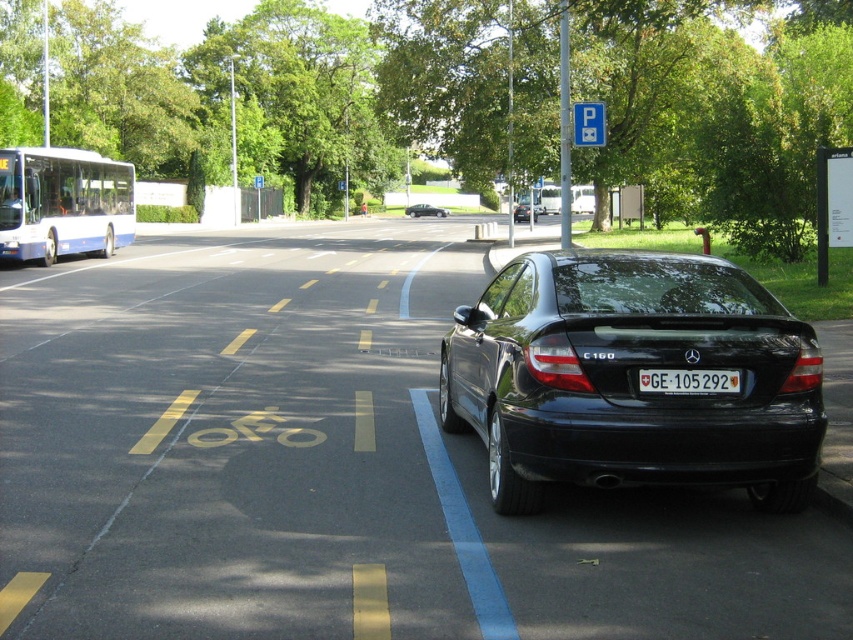
Can you confirm if black glossy car at center is positioned above white plastic license plate at center?

No.

Who is more forward, [595,481] or [733,371]?

Point [733,371] is in front.

Who is more distant from viewer, (543,332) or (653,387)?

The point (543,332) is more distant.

Locate an element on the screen. black glossy car at center is located at coordinates (631, 378).

Can you confirm if white matte bus at upper left is thinner than shiny black sedan at center?

Yes.

From the picture: Is white matte bus at upper left positioned before shiny black sedan at center?

Yes, it is.

Between point (33, 205) and point (412, 212), which one is positioned in front?

Point (33, 205) is more forward.

The image size is (853, 640). What are the coordinates of `white matte bus at upper left` in the screenshot? It's located at (62, 204).

Between white matte bus at upper left and white plastic license plate at center, which one is positioned lower?

white plastic license plate at center is below.

Does white matte bus at upper left appear over white plastic license plate at center?

Yes, white matte bus at upper left is above white plastic license plate at center.

Where is `white matte bus at upper left`? The image size is (853, 640). white matte bus at upper left is located at coordinates (62, 204).

Image resolution: width=853 pixels, height=640 pixels. I want to click on white matte bus at upper left, so click(62, 204).